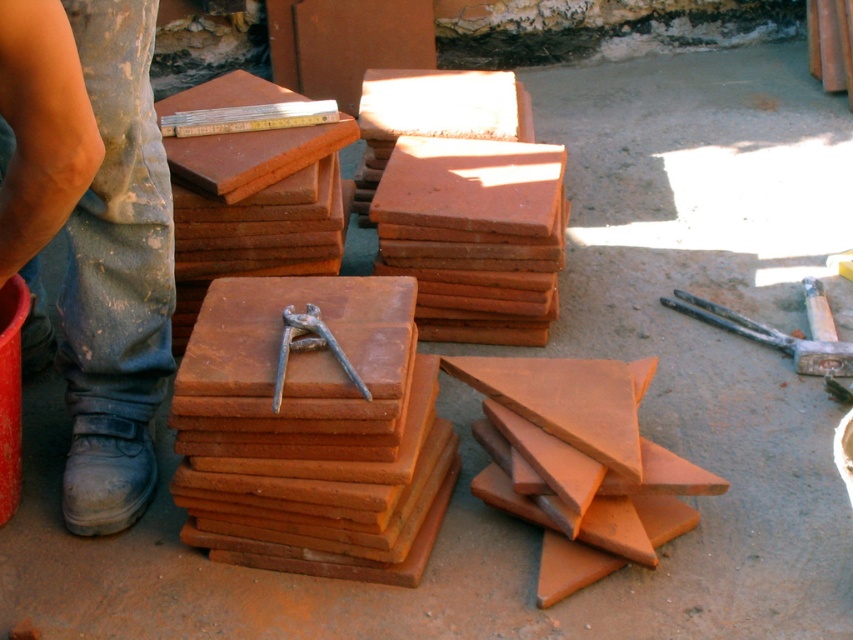
Identify the location of blue jeans at lower left. The height and width of the screenshot is (640, 853). (90, 234).

Between blue jeans at lower left and rusty metal hammer at lower right, which one appears on the right side from the viewer's perspective?

From the viewer's perspective, rusty metal hammer at lower right appears more on the right side.

The height and width of the screenshot is (640, 853). I want to click on blue jeans at lower left, so click(90, 234).

This screenshot has width=853, height=640. I want to click on blue jeans at lower left, so click(x=90, y=234).

Can you confirm if terracotta clay tiles at lower right is positioned to the left of rusty metal pliers at center?

In fact, terracotta clay tiles at lower right is to the right of rusty metal pliers at center.

Is terracotta clay tiles at lower right wider than rusty metal pliers at center?

Yes.

Is point (647, 563) less distant than point (334, 352)?

No, it is not.

Identify the location of terracotta clay tiles at lower right. This screenshot has height=640, width=853. (579, 461).

Consider the image. Between terracotta clay tiles at center and rusty metal hammer at lower right, which one is positioned higher?

rusty metal hammer at lower right

Does terracotta clay tiles at center come behind rusty metal hammer at lower right?

No.

Locate an element on the screen. The height and width of the screenshot is (640, 853). terracotta clay tiles at center is located at coordinates (311, 433).